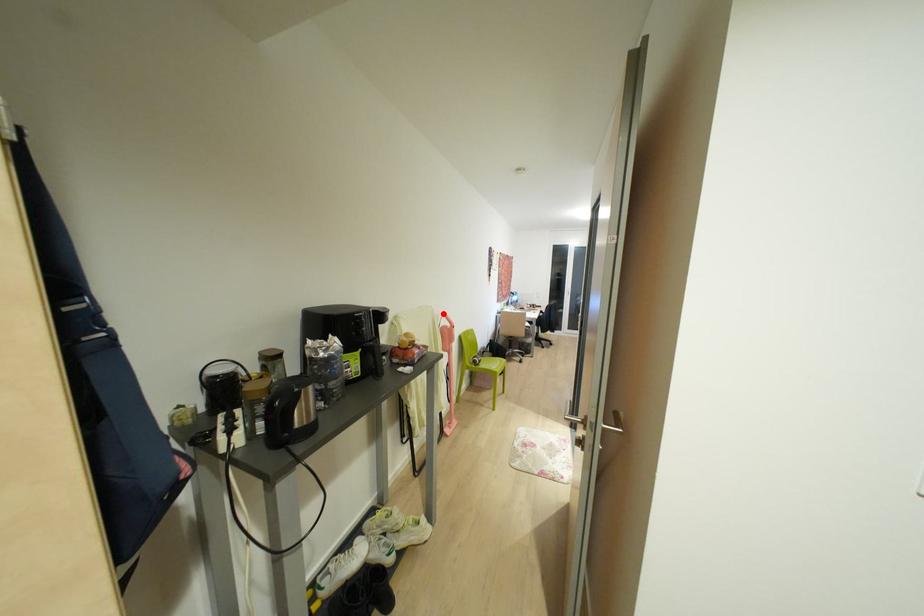
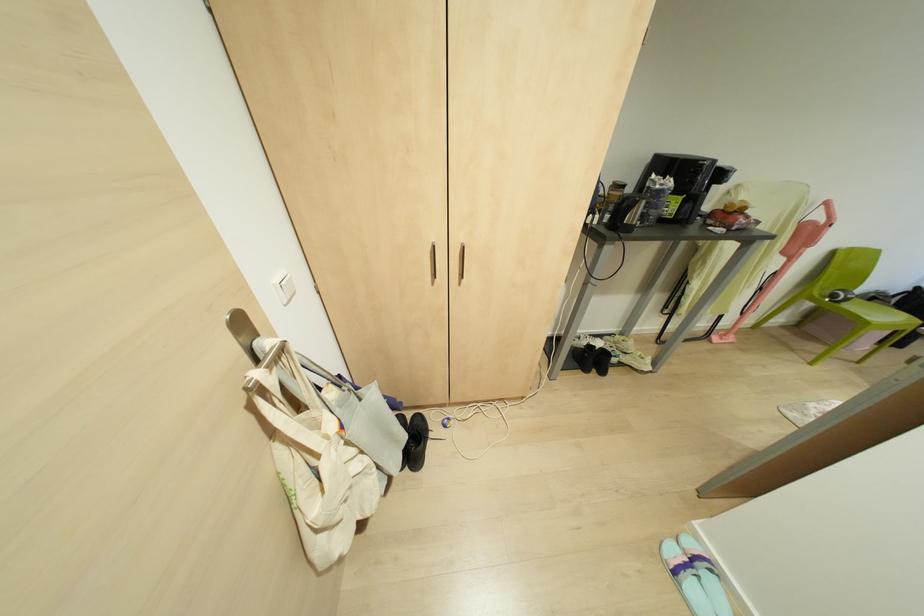
Where in the second image is the point corresponding to the highlighted location from the first image?

(825, 203)